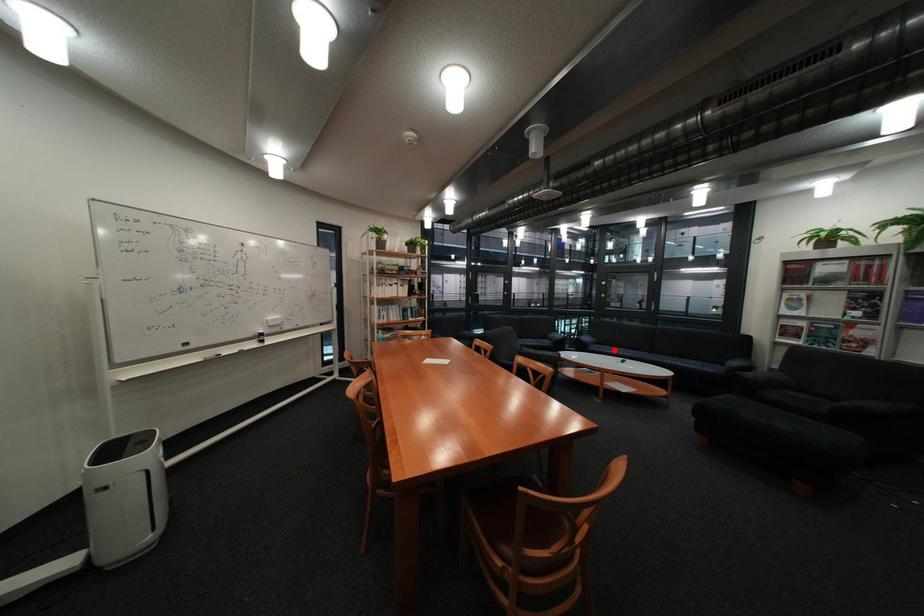
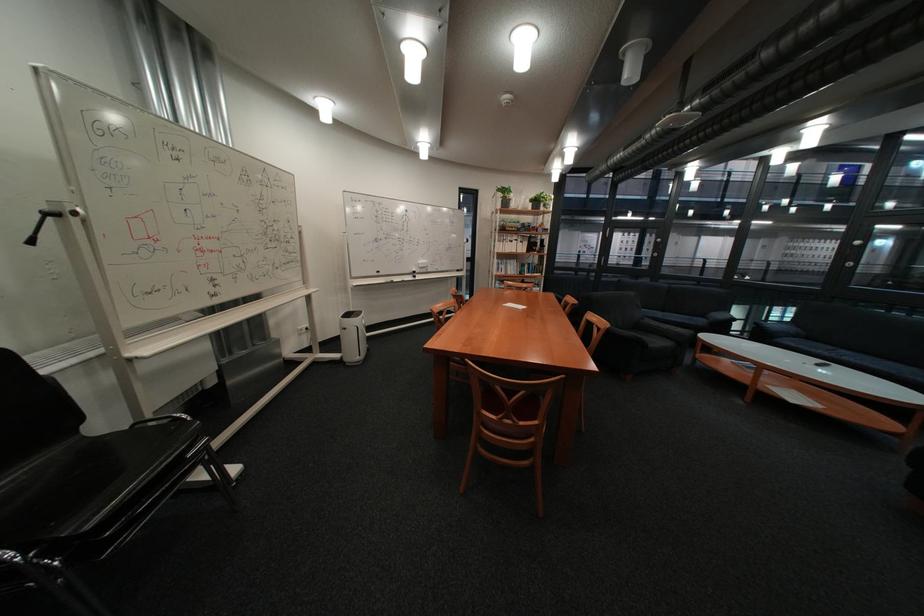
Question: I am providing you with two images of the same scene from different viewpoints. Given a red point in image1, look at the same physical point in image2. Is it:

Choices:
 (A) Closer to the viewpoint
 (B) Farther from the viewpoint

Answer: (A)